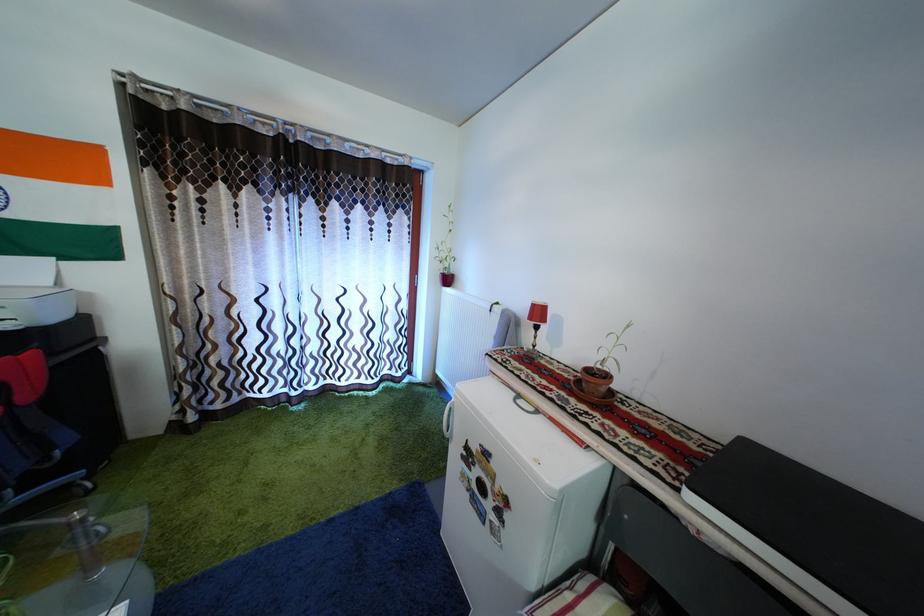
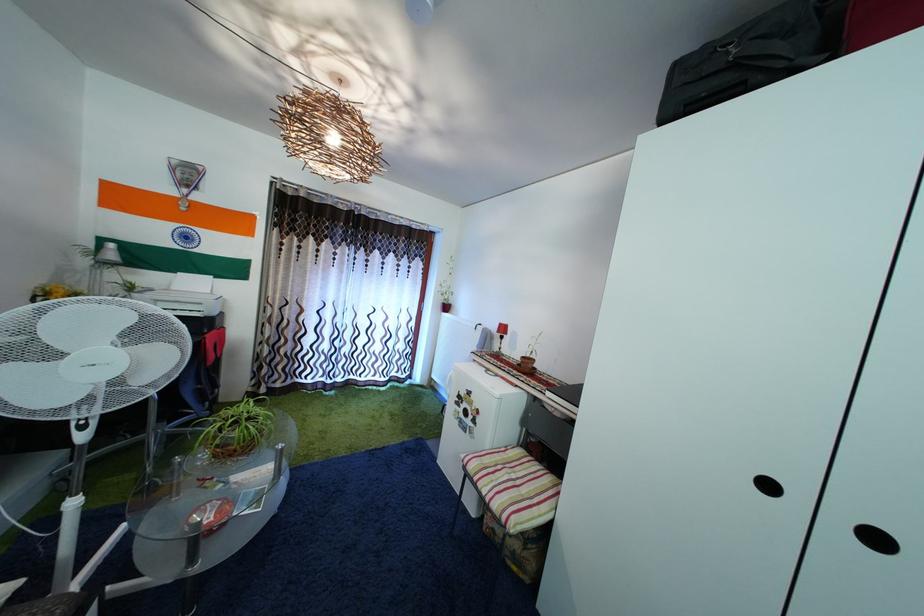
Where in the second image is the point corresponding to (x=526, y=331) from the first image?

(500, 345)